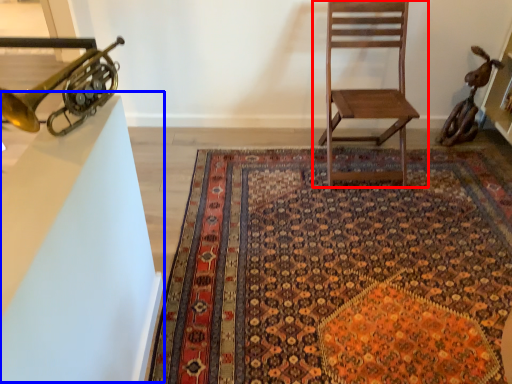
Question: Which of the following is the closest to the observer, chair (highlighted by a red box) or table (highlighted by a blue box)?

Choices:
 (A) chair
 (B) table

Answer: (B)